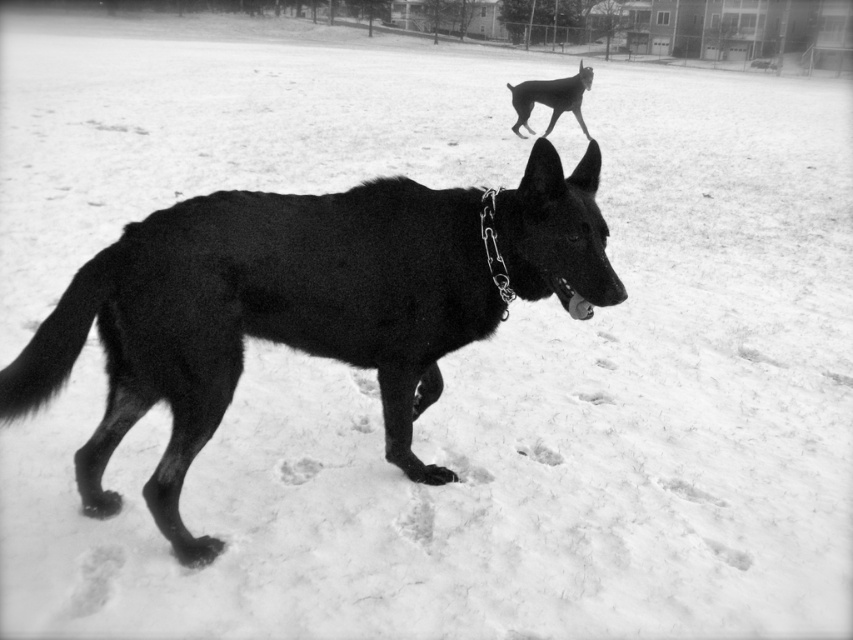
Question: Can you confirm if shiny black dog at upper center is positioned above metallic chain at center?

Choices:
 (A) no
 (B) yes

Answer: (B)

Question: Which object is closer to the camera taking this photo?

Choices:
 (A) shiny black dog at upper center
 (B) black chain-link collar at center
 (C) metallic chain at center

Answer: (B)

Question: Estimate the real-world distances between objects in this image. Which object is closer to the shiny black dog at upper center?

Choices:
 (A) black chain-link collar at center
 (B) metallic chain at center

Answer: (A)

Question: Can you confirm if black chain-link collar at center is positioned below shiny black dog at upper center?

Choices:
 (A) yes
 (B) no

Answer: (A)

Question: Is black chain-link collar at center smaller than metallic chain at center?

Choices:
 (A) yes
 (B) no

Answer: (B)

Question: Which point is farther from the camera taking this photo?

Choices:
 (A) (517, 115)
 (B) (183, 412)

Answer: (A)